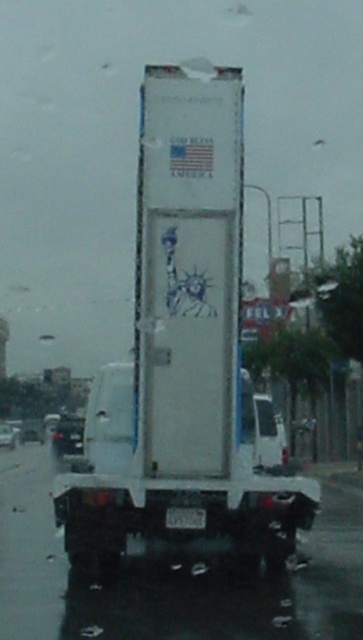
You are a pedestrian standing at the intersection and want to cross the road safely. You see the white matte truck at center and the shiny black car at lower left approaching. Which vehicle is closer to you in height?

The white matte truck at center is shorter than the shiny black car at lower left, so the shiny black car at lower left is taller and closer to your height.

You are a driver approaching an intersection and see the white matte truck at center and the shiny black car at lower left. Which vehicle should you be cautious of overtaking based on their sizes?

The white matte truck at center is smaller than the shiny black car at lower left, so you should be cautious of overtaking the shiny black car at lower left since it is larger and may block your view or require more space.